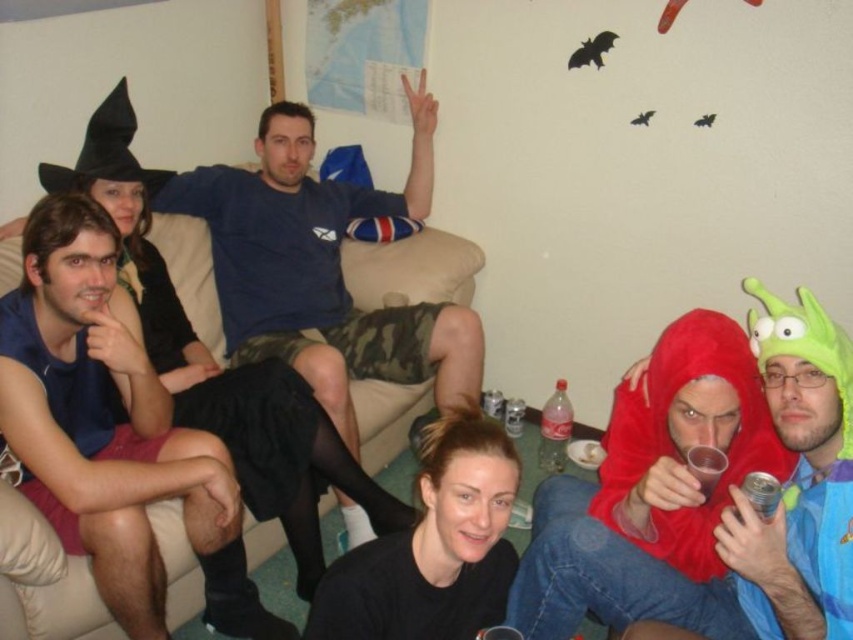
Question: Which point is farther to the camera?

Choices:
 (A) (523, 412)
 (B) (741, 422)
 (C) (274, 358)

Answer: (A)

Question: Which object is positioned closest to the blue cotton t-shirt at center?

Choices:
 (A) red fleece hoodie at lower right
 (B) metallic can at lower center
 (C) metallic silver can at lower right

Answer: (B)

Question: Is dark blue sleeveless shirt at left positioned in front of black fabric skirt at left?

Choices:
 (A) no
 (B) yes

Answer: (B)

Question: Estimate the real-world distances between objects in this image. Which object is closer to the metallic silver can at lower right?

Choices:
 (A) metallic can at lower center
 (B) translucent plastic cup at lower right
 (C) black fabric skirt at left
 (D) black matte shirt at center

Answer: (B)

Question: Is dark blue sleeveless shirt at left closer to camera compared to clear plastic bottle at lower center?

Choices:
 (A) yes
 (B) no

Answer: (A)

Question: Where is blue cotton t-shirt at upper center located in relation to clear plastic bottle at lower center in the image?

Choices:
 (A) left
 (B) right

Answer: (A)